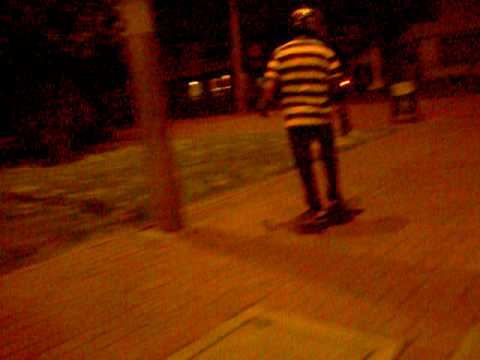
The width and height of the screenshot is (480, 360). What are the coordinates of `cover` in the screenshot? It's located at (297, 347).